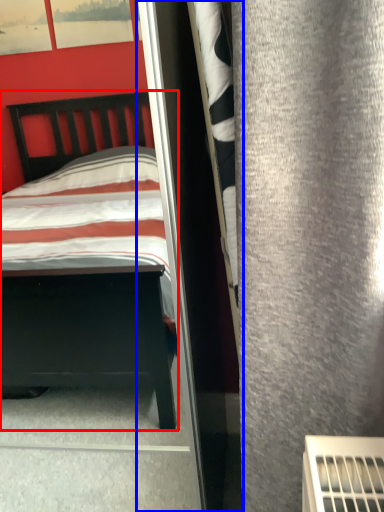
Question: Which point is further to the camera, bed (highlighted by a red box) or screen door (highlighted by a blue box)?

Choices:
 (A) bed
 (B) screen door

Answer: (B)